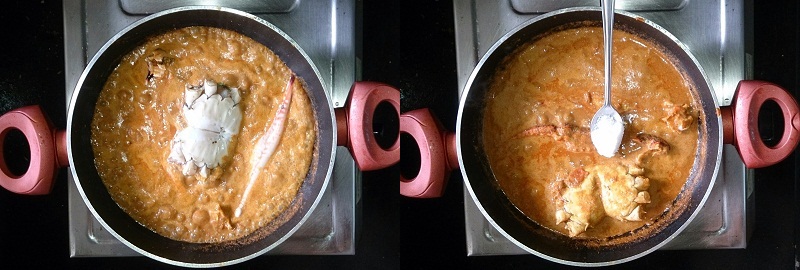
Image resolution: width=800 pixels, height=270 pixels. What are the coordinates of `metal pot` in the screenshot? It's located at [x=301, y=225], [x=489, y=223].